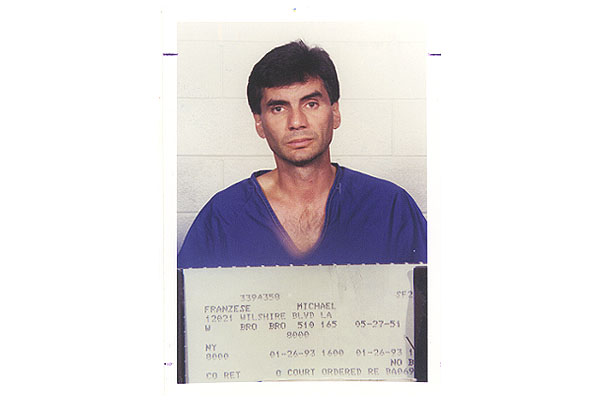
Image resolution: width=600 pixels, height=400 pixels. I want to click on white wall, so click(206, 51).